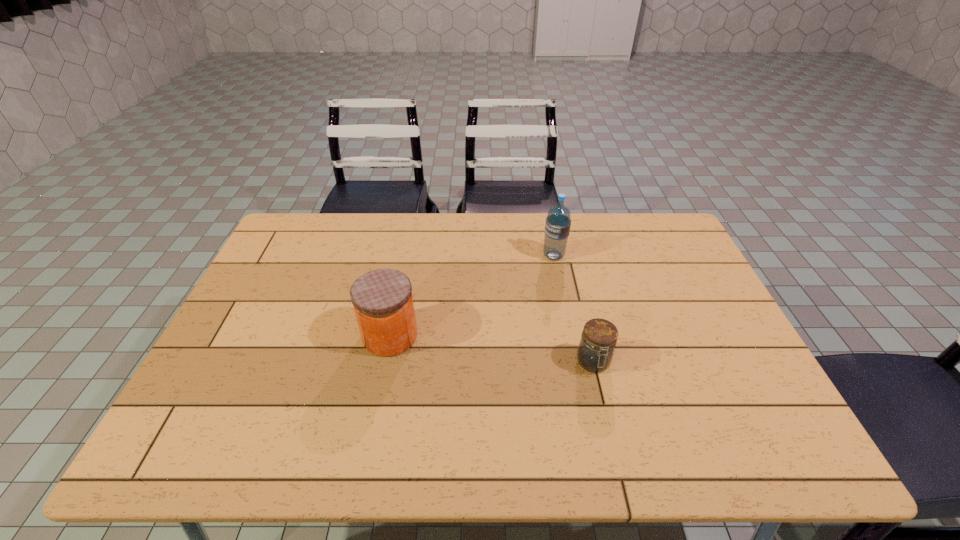
Find the location of a particular element. free spot between the tallest object and the left jar is located at coordinates (472, 296).

Where is `vacant space that's between the farthest object and the shorter jar`? The width and height of the screenshot is (960, 540). vacant space that's between the farthest object and the shorter jar is located at coordinates (573, 309).

Find the location of `vacant space that is in between the right jar and the leftmost object`. vacant space that is in between the right jar and the leftmost object is located at coordinates (492, 349).

Locate an element on the screen. vacant point located between the right jar and the water bottle is located at coordinates (573, 309).

This screenshot has height=540, width=960. What are the coordinates of `vacant space that is in between the shorter jar and the leftmost object` in the screenshot? It's located at (492, 349).

Identify the location of free space between the farthest object and the leftmost object. (472, 296).

In order to click on empty location between the right jar and the leftmost object in this screenshot , I will do `click(492, 349)`.

Find the location of a particular element. vacant space in between the second shortest object and the farthest object is located at coordinates (472, 296).

Where is `object that can be found as the closest to the shortest object`? This screenshot has height=540, width=960. object that can be found as the closest to the shortest object is located at coordinates (558, 221).

Point out which object is positioned as the nearest to the leftmost object. Please provide its 2D coordinates. Your answer should be formatted as a tuple, i.e. [(x, y)], where the tuple contains the x and y coordinates of a point satisfying the conditions above.

[(595, 352)]